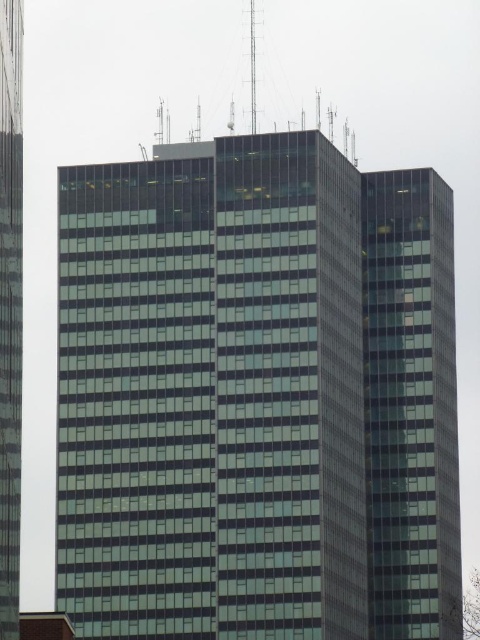
Question: Which point is closer to the camera?

Choices:
 (A) green glass building at center
 (B) transparent glass building at left

Answer: (B)

Question: Can you confirm if green glass building at center is wider than transparent glass building at left?

Choices:
 (A) yes
 (B) no

Answer: (A)

Question: Which of the following is the closest to the observer?

Choices:
 (A) transparent glass building at left
 (B) green glass building at center

Answer: (A)

Question: Is green glass building at center bigger than transparent glass building at left?

Choices:
 (A) yes
 (B) no

Answer: (A)

Question: Can you confirm if green glass building at center is positioned above transparent glass building at left?

Choices:
 (A) no
 (B) yes

Answer: (A)